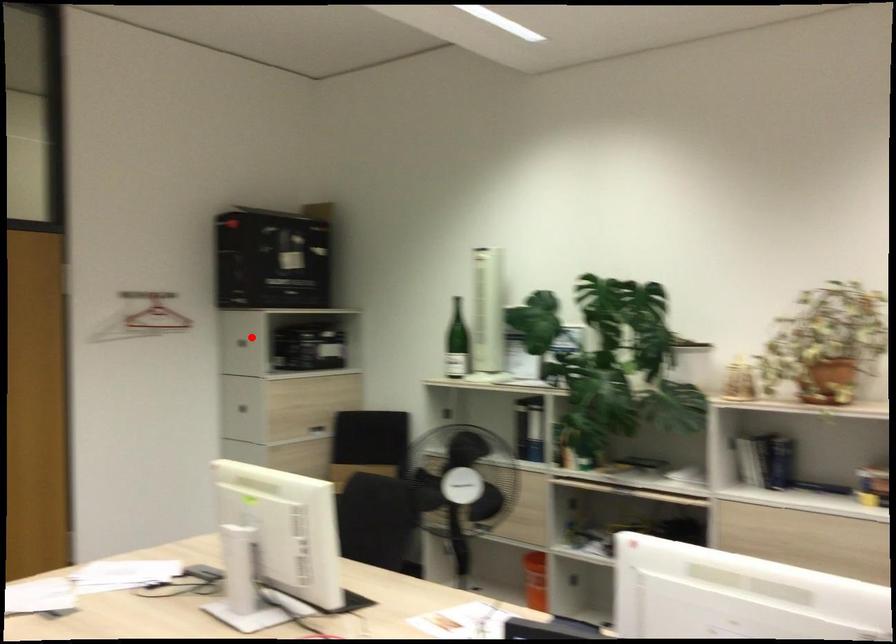
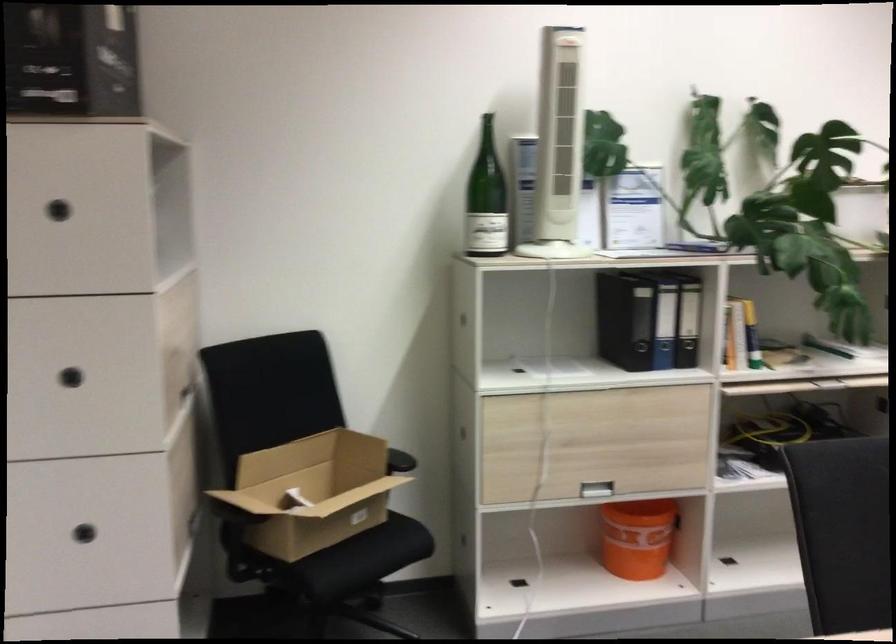
Question: I am providing you with two images of the same scene from different viewpoints. Image1 has a red point marked. In image2, the corresponding 3D location appears at what relative position? Reply with the corresponding letter.

Choices:
 (A) Closer
 (B) Farther

Answer: (A)